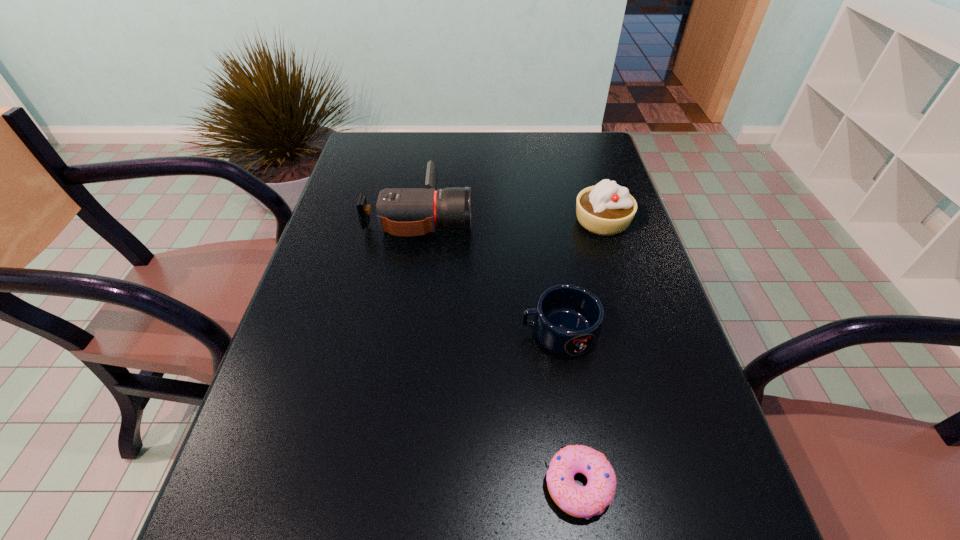
Where is `free region located 0.110m with the handle on the side of the mug`? free region located 0.110m with the handle on the side of the mug is located at coordinates (467, 332).

This screenshot has width=960, height=540. I want to click on vacant area situated on the back of the nearest object, so click(x=552, y=302).

At what (x,y) coordinates should I click in order to perform the action: click on object present at the left edge. Please return your answer as a coordinate pair (x, y). Looking at the image, I should click on (400, 211).

I want to click on whipped cream present at the right edge, so click(606, 209).

Identify the location of mug that is at the right edge. The width and height of the screenshot is (960, 540). (568, 319).

Find the location of a particular element. This screenshot has height=540, width=960. blank area at the far edge is located at coordinates (536, 163).

Find the location of a particular element. vacant area at the left edge of the desktop is located at coordinates (323, 481).

The image size is (960, 540). What are the coordinates of `free space at the right edge of the desktop` in the screenshot? It's located at pyautogui.click(x=677, y=380).

In the image, there is a desktop. Find the location of `vacant space at the far right corner`. vacant space at the far right corner is located at coordinates (571, 133).

I want to click on free space between the leftmost object and the doughnut, so click(499, 350).